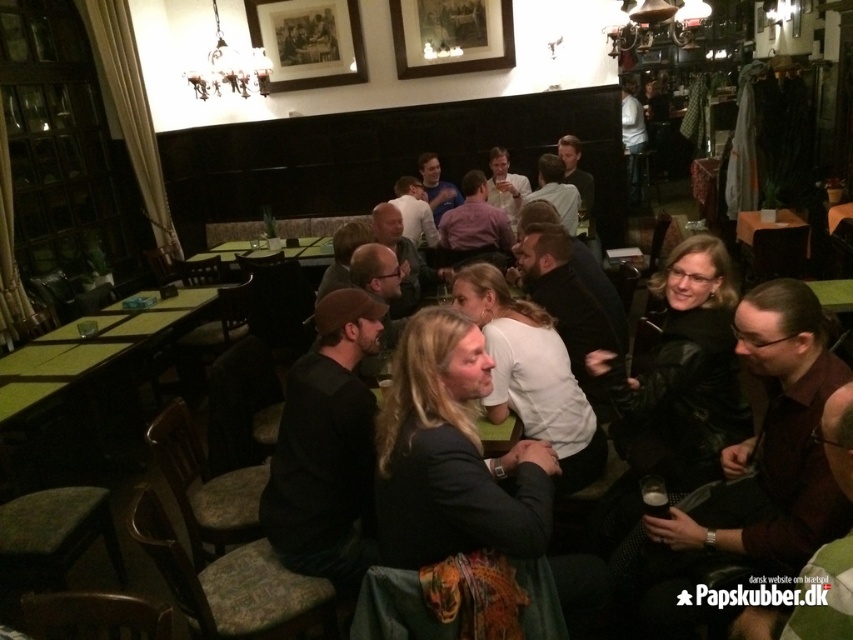
Is dark brown leather jacket at center thinner than green wooden table at center?

Yes.

In the scene shown: Is dark brown leather jacket at center smaller than green wooden table at center?

Yes, dark brown leather jacket at center is smaller than green wooden table at center.

Is point (405, 620) less distant than point (277, 250)?

That is True.

Where is `dark brown leather jacket at center`? Image resolution: width=853 pixels, height=640 pixels. dark brown leather jacket at center is located at coordinates (456, 502).